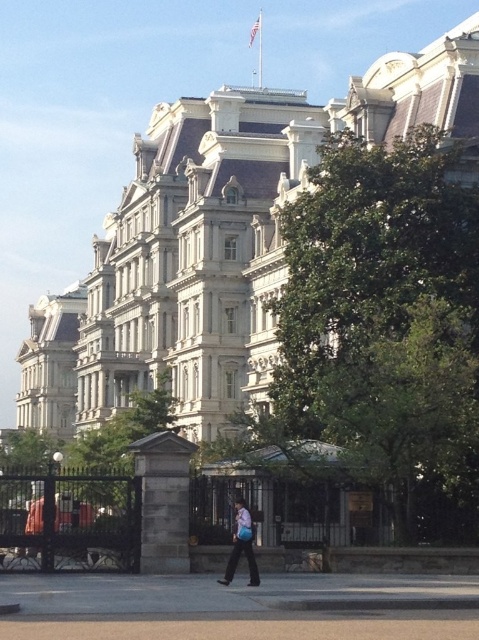
You are planning to take a photo of the white stone building at center and the gray concrete pavement at lower center. Which object should you focus on first if you want to capture both in a single frame without moving the camera?

The white stone building at center is larger in size than the gray concrete pavement at lower center, so you should focus on the white stone building at center first to ensure it fills the frame appropriately while still capturing the smaller gray concrete pavement at lower center in the background.

You are standing at the entrance of the white stone building at center. What are the coordinates of the building?

The white stone building at center is located at coordinates point (217, 243).

You are standing at the entrance of a large property and see the white stone building at center. If you want to reach the building quickly, would you walk straight ahead or turn left? Explain your reasoning based on the scene description.

You should walk straight ahead to reach the white stone building at center because it is the central structure in the scene, and the paved area leads directly towards it. Turning left would likely take you away from the building.